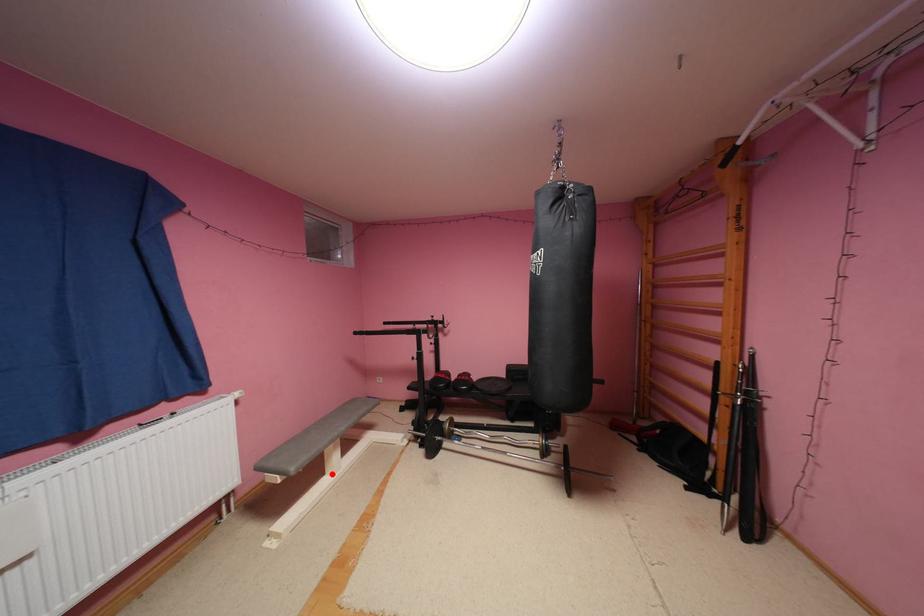
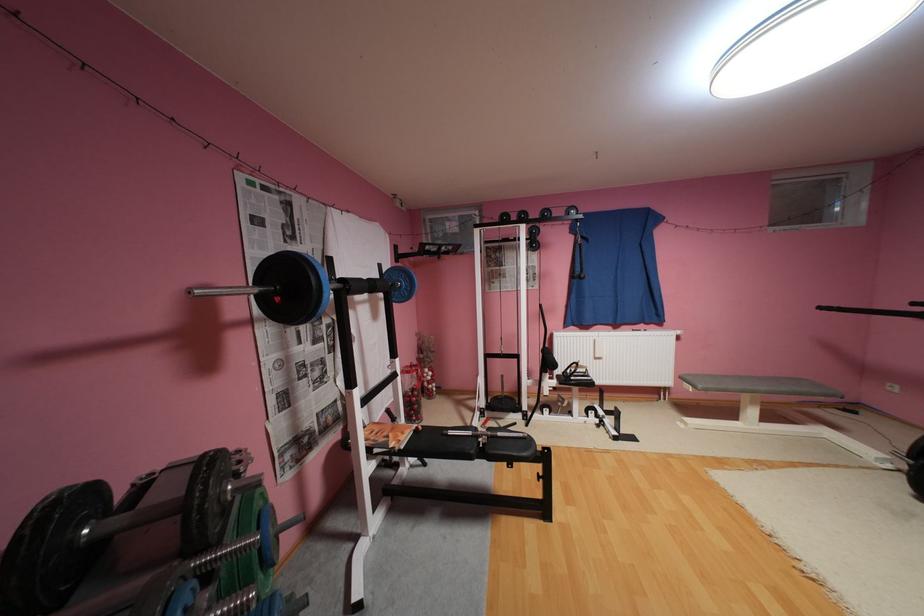
Question: I am providing you with two images of the same scene from different viewpoints. In image1, a red point is highlighted. Considering the same 3D point in image2, which of the following is correct?

Choices:
 (A) It is closer
 (B) It is farther

Answer: (A)